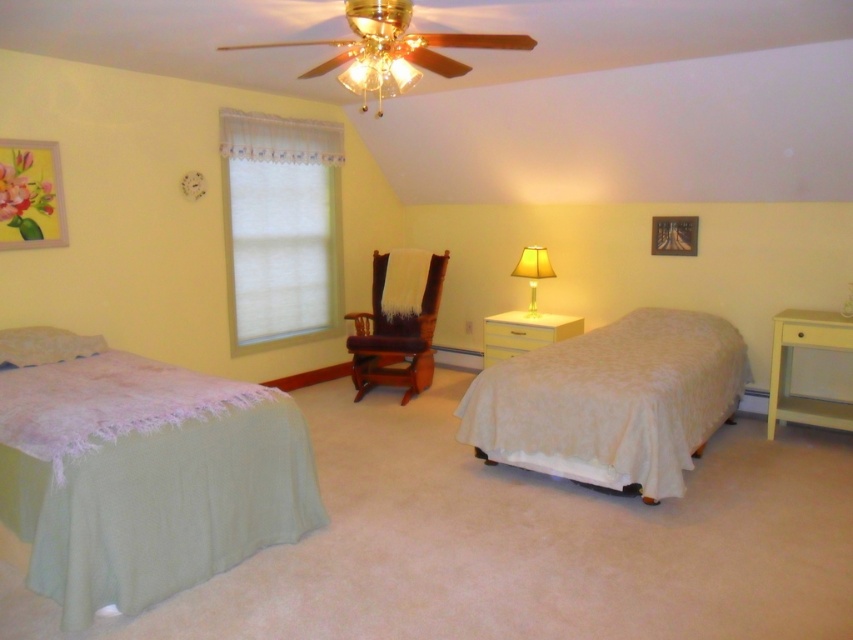
Can you confirm if satin green bed at left is shorter than white textured blinds at center?

Indeed, satin green bed at left has a lesser height compared to white textured blinds at center.

Does satin green bed at left lie behind white textured blinds at center?

No, it is in front of white textured blinds at center.

Is point (21, 404) closer to camera compared to point (325, 122)?

That is True.

The width and height of the screenshot is (853, 640). In order to click on satin green bed at left in this screenshot , I will do `click(144, 477)`.

Does white textured blinds at center have a smaller size compared to white glossy dresser at center?

Incorrect, white textured blinds at center is not smaller in size than white glossy dresser at center.

The height and width of the screenshot is (640, 853). I want to click on white textured blinds at center, so click(x=281, y=227).

Identify the location of white textured blinds at center. This screenshot has width=853, height=640. (281, 227).

Does white textured blinds at center have a lesser height compared to brown leather armchair at center?

In fact, white textured blinds at center may be taller than brown leather armchair at center.

Can you confirm if white textured blinds at center is positioned above brown leather armchair at center?

Indeed, white textured blinds at center is positioned over brown leather armchair at center.

What do you see at coordinates (281, 227) in the screenshot? Image resolution: width=853 pixels, height=640 pixels. I see `white textured blinds at center` at bounding box center [281, 227].

The width and height of the screenshot is (853, 640). I want to click on white textured blinds at center, so click(x=281, y=227).